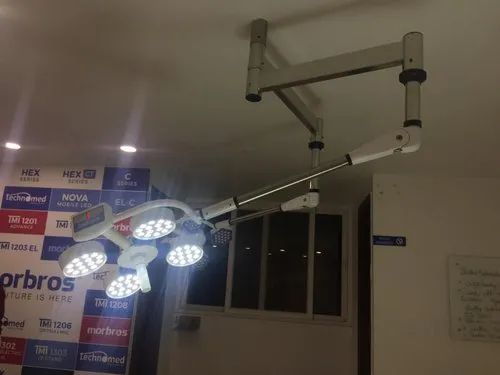
The height and width of the screenshot is (375, 500). I want to click on ceiling, so click(x=160, y=70).